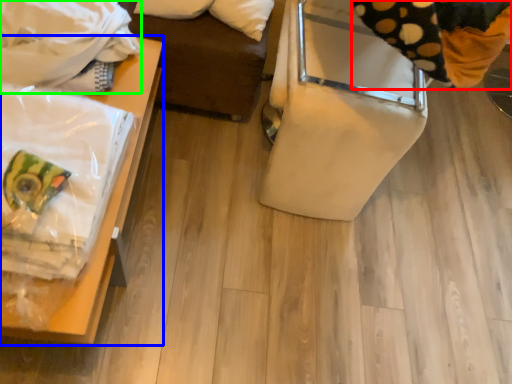
Question: Based on their relative distances, which object is nearer to material (highlighted by a red box)? Choose from furniture (highlighted by a blue box) and blanket (highlighted by a green box).

Choices:
 (A) furniture
 (B) blanket

Answer: (A)